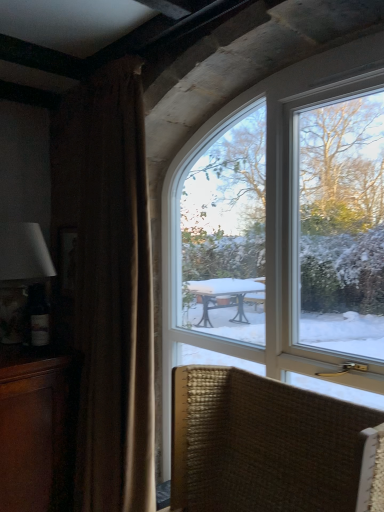
Question: In the image, is wooden cabinet at left on the left side or the right side of woven fabric chair at lower right?

Choices:
 (A) left
 (B) right

Answer: (A)

Question: Which is correct: wooden cabinet at left is inside woven fabric chair at lower right, or outside of it?

Choices:
 (A) outside
 (B) inside

Answer: (A)

Question: Considering the real-world distances, which object is closest to the brown velvet curtain at left?

Choices:
 (A) wooden cabinet at left
 (B) woven fabric chair at lower right
 (C) clear glass window at upper center
 (D) matte white lampshade at left

Answer: (A)

Question: Which of these objects is positioned closest to the brown velvet curtain at left?

Choices:
 (A) matte white lampshade at left
 (B) woven fabric chair at lower right
 (C) clear glass window at upper center
 (D) wooden cabinet at left

Answer: (D)